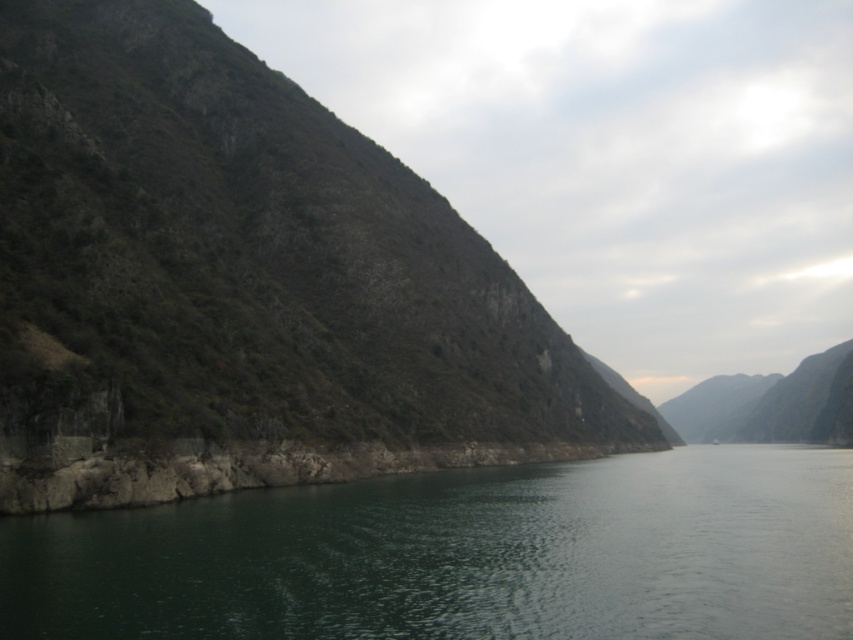
Is point (270, 355) behind point (596, 461)?

No.

Is the position of green rocky mountain at left more distant than that of green smooth water at center?

Yes, green rocky mountain at left is behind green smooth water at center.

Between point (445, 221) and point (648, 564), which one is positioned behind?

Point (445, 221)

Identify the location of green rocky mountain at left. (245, 284).